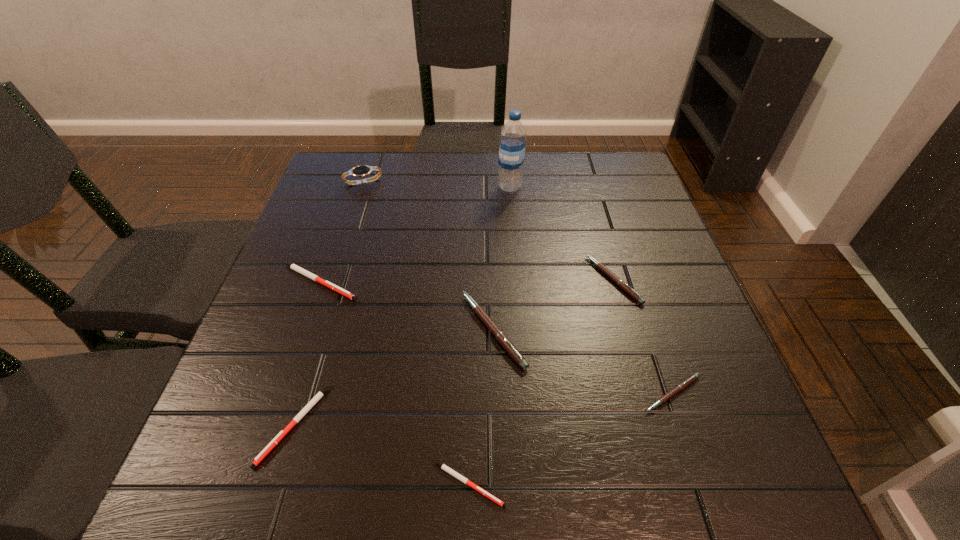
The width and height of the screenshot is (960, 540). Find the location of `blank region between the water bottle and the farthest white pen`. blank region between the water bottle and the farthest white pen is located at coordinates (414, 234).

The width and height of the screenshot is (960, 540). Identify the location of free space that is in between the second biggest white pen and the black watch. (329, 303).

This screenshot has width=960, height=540. I want to click on free spot between the leftmost pink pen and the watch, so click(x=428, y=256).

You are a GUI agent. You are given a task and a screenshot of the screen. Output one action in this format:
    pyautogui.click(x=<x>, y=<y>)
    Task: Click on the free space between the blue water bottle and the second smallest pink pen
    Image resolution: width=960 pixels, height=540 pixels.
    Given the screenshot: What is the action you would take?
    pyautogui.click(x=562, y=233)

I want to click on object that stands as the fifth closest to the tallest object, so click(695, 376).

Identify the location of the second closest object to the second biggest pink pen. Image resolution: width=960 pixels, height=540 pixels. (695, 376).

Choose which pen is the third nearest neighbor to the seventh shortest object. Please provide its 2D coordinates. Your answer should be formatted as a tuple, i.e. [(x, y)], where the tuple contains the x and y coordinates of a point satisfying the conditions above.

[(624, 286)]

This screenshot has height=540, width=960. Identify the location of pen that stands as the closest to the second smallest pink pen. (500, 336).

Point out which pink pen is positioned as the third nearest to the second biggest white pen. Please provide its 2D coordinates. Your answer should be formatted as a tuple, i.e. [(x, y)], where the tuple contains the x and y coordinates of a point satisfying the conditions above.

[(695, 376)]

Identify the location of pink pen that is the third closest to the smallest white pen. (624, 286).